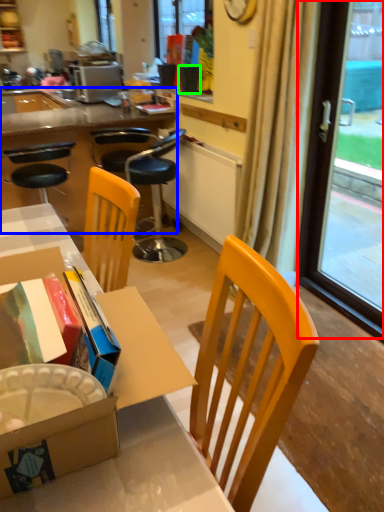
Question: Which is nearer to the window screen (highlighted by a red box)? desk (highlighted by a blue box) or flowerpot (highlighted by a green box).

Choices:
 (A) desk
 (B) flowerpot

Answer: (B)